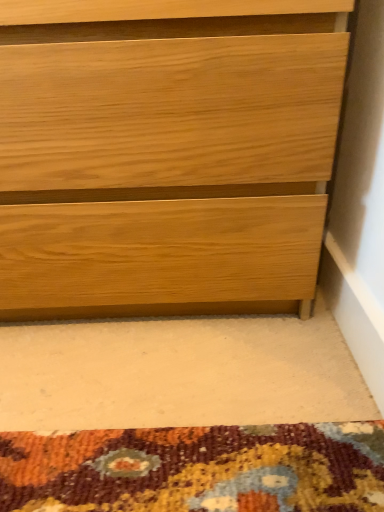
Question: Should I look upward or downward to see natural wood chest of drawers at lower right?

Choices:
 (A) down
 (B) up

Answer: (B)